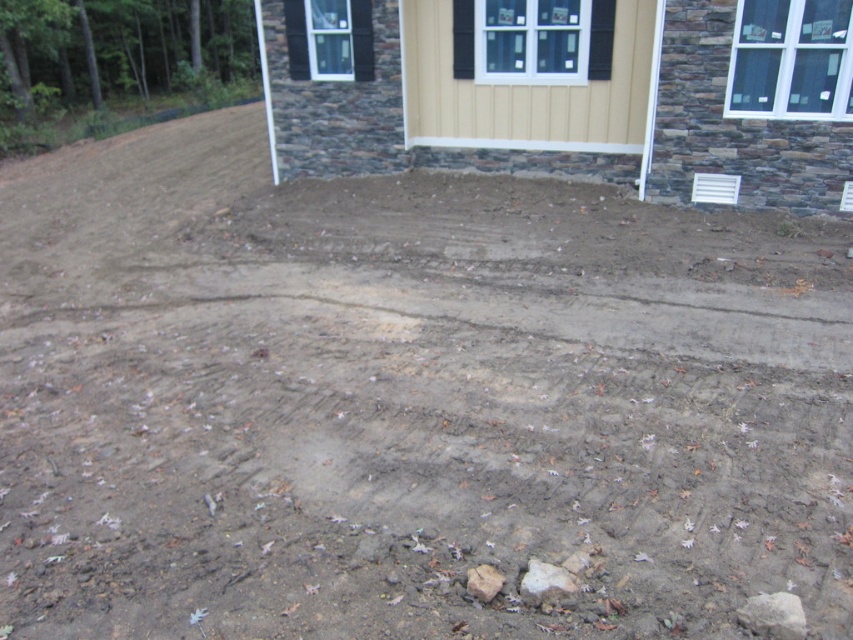
Question: Is gray rough rock at lower center wider than gray rough stone at lower center?

Choices:
 (A) no
 (B) yes

Answer: (B)

Question: Which point is farther from the camera taking this photo?

Choices:
 (A) (541, 577)
 (B) (769, 616)
 (C) (496, 577)

Answer: (C)

Question: Does gray rough stone at lower right appear under gray rough stone at lower center?

Choices:
 (A) no
 (B) yes

Answer: (B)

Question: Estimate the real-world distances between objects in this image. Which object is closer to the gray rough rock at lower center?

Choices:
 (A) gray rough stone at lower right
 (B) gray rough stone at lower center

Answer: (B)

Question: Which is farther from the gray rough stone at lower right?

Choices:
 (A) gray rough stone at lower center
 (B) gray rough rock at lower center

Answer: (A)

Question: Is gray rough rock at lower center closer to the viewer compared to gray rough stone at lower center?

Choices:
 (A) no
 (B) yes

Answer: (B)